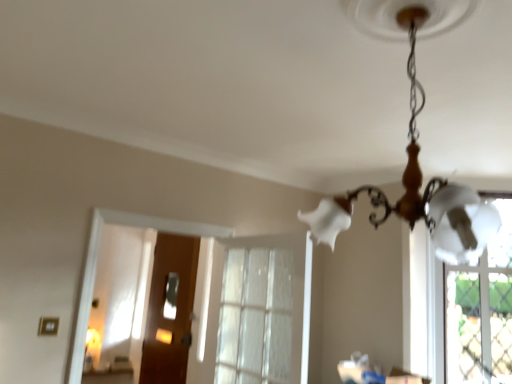
Question: Considering their positions, is clear glass window at center located in front of or behind wooden door at center?

Choices:
 (A) front
 (B) behind

Answer: (A)

Question: Looking at their shapes, would you say clear glass window at center is wider or thinner than wooden door at center?

Choices:
 (A) wide
 (B) thin

Answer: (A)

Question: Which object is positioned farthest from the white glass chandelier at upper center?

Choices:
 (A) wooden door at center
 (B) clear glass window at center

Answer: (A)

Question: Estimate the real-world distances between objects in this image. Which object is farther from the wooden door at center?

Choices:
 (A) white glass chandelier at upper center
 (B) clear glass window at center

Answer: (A)